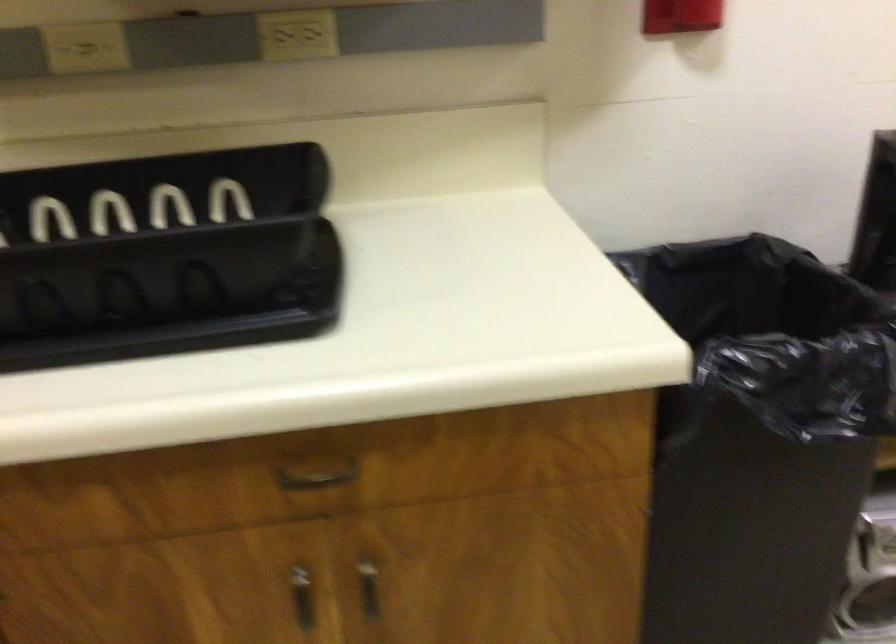
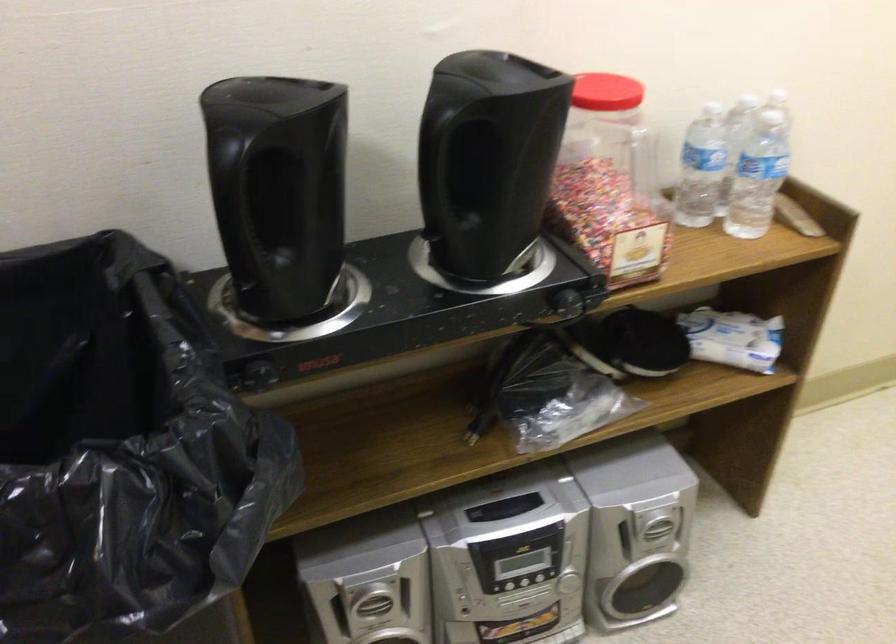
Looking at this image, which direction would the cameraman need to move to produce the second image?

The movement direction of the cameraman is right, forward.